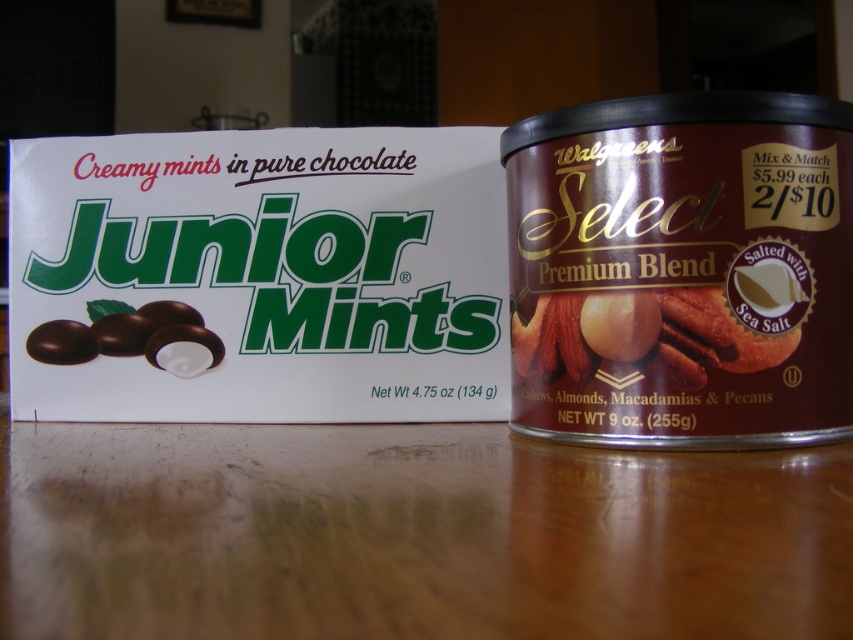
Is brown glossy nuts at center bigger than chocolate matte junior mints at left?

Yes.

Measure the distance between point (718, 328) and camera.

21.43 inches

Image resolution: width=853 pixels, height=640 pixels. Find the location of `brown glossy nuts at center`. brown glossy nuts at center is located at coordinates (641, 333).

Who is positioned more to the right, brown glossy nuts at center or matte chocolate mints at left?

brown glossy nuts at center

Between brown glossy nuts at center and matte chocolate mints at left, which one has less height?

matte chocolate mints at left

Is point (593, 320) in front of point (55, 356)?

Yes, it is in front of point (55, 356).

Locate an element on the screen. The image size is (853, 640). brown glossy nuts at center is located at coordinates (641, 333).

Is chocolate matte junior mints at left bigger than matte chocolate mints at left?

Indeed, chocolate matte junior mints at left has a larger size compared to matte chocolate mints at left.

Does point (193, 349) lie in front of point (76, 340)?

Yes, it is in front of point (76, 340).

You are a GUI agent. You are given a task and a screenshot of the screen. Output one action in this format:
    pyautogui.click(x=<x>, y=<y>)
    Task: Click on the chocolate matte junior mints at left
    This screenshot has height=640, width=853.
    Given the screenshot: What is the action you would take?
    [x=132, y=339]